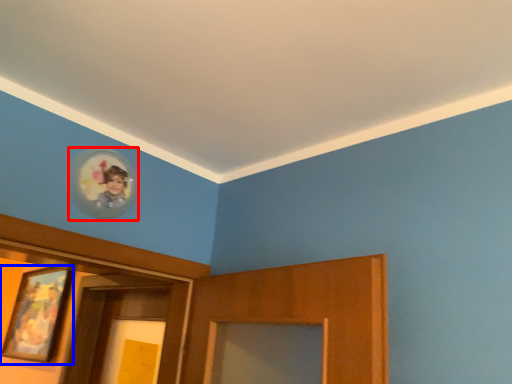
Question: Which of the following is the closest to the observer, picture frame (highlighted by a red box) or picture frame (highlighted by a blue box)?

Choices:
 (A) picture frame
 (B) picture frame

Answer: (A)